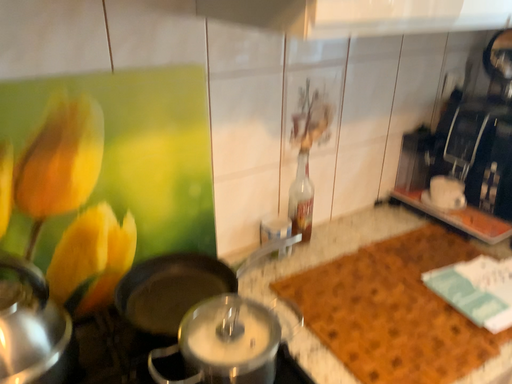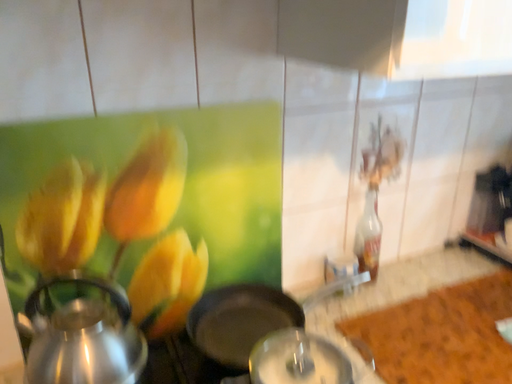
Question: How did the camera likely rotate when shooting the video?

Choices:
 (A) rotated right
 (B) rotated left

Answer: (B)